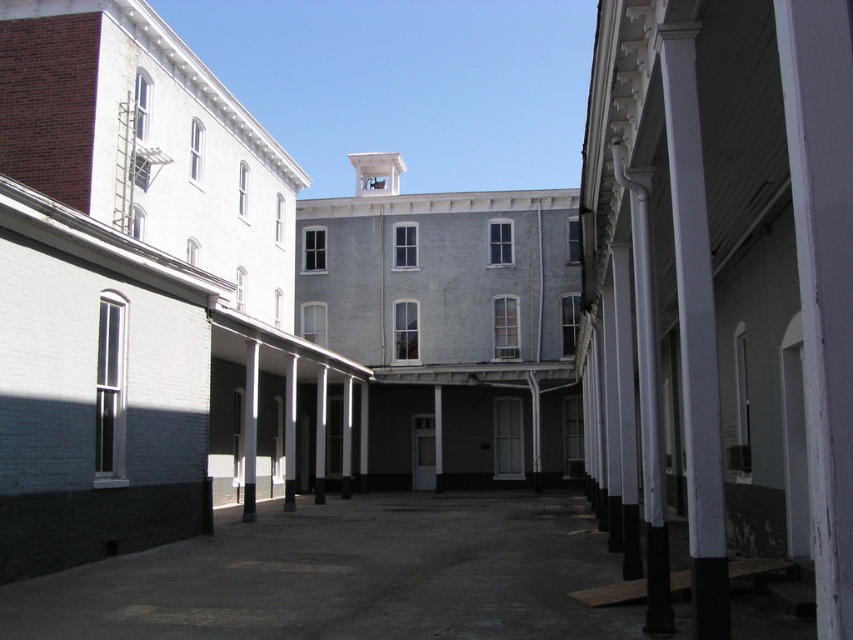
You are standing in the courtyard and want to walk from the dark concrete alley at center to the white painted wood column at right. Which direction should you move to reach the column?

The dark concrete alley at center is positioned on the left side of the white painted wood column at right, so you should move to the right to reach the column.

You are standing in the courtyard and want to walk from the white painted wood column at right to the dark concrete alley at center. Which direction should you move to reach the alley?

You should move forward towards the dark concrete alley at center because the white painted wood column at right is behind it, meaning the alley is in front of the column.